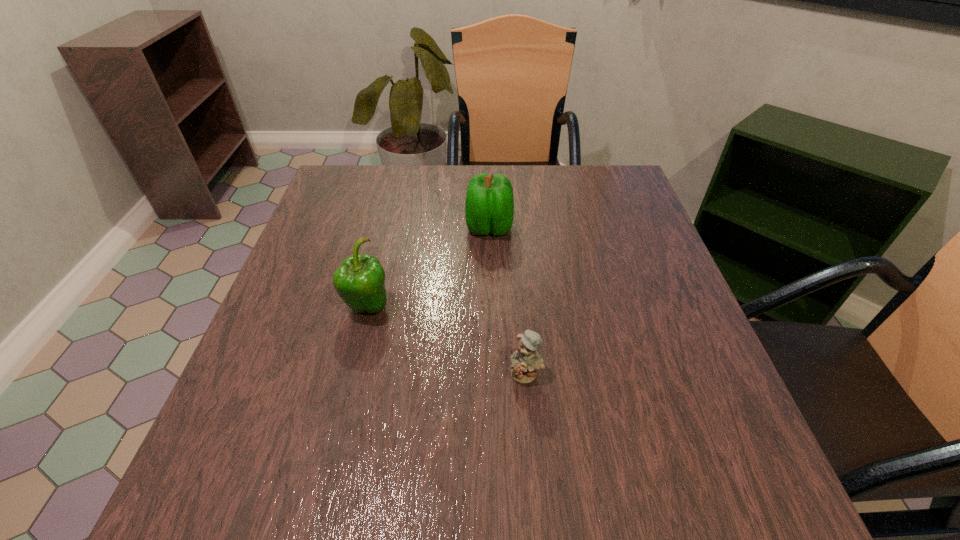
The height and width of the screenshot is (540, 960). Find the location of `the leftmost object`. the leftmost object is located at coordinates (360, 280).

Locate an element on the screen. Image resolution: width=960 pixels, height=540 pixels. the nearer bell pepper is located at coordinates (360, 280).

I want to click on the farthest object, so click(x=489, y=208).

You are a GUI agent. You are given a task and a screenshot of the screen. Output one action in this format:
    pyautogui.click(x=<x>, y=<y>)
    Task: Click on the farther bell pepper
    The height and width of the screenshot is (540, 960).
    Given the screenshot: What is the action you would take?
    pyautogui.click(x=489, y=208)

Locate an element on the screen. The width and height of the screenshot is (960, 540). the shortest object is located at coordinates (525, 361).

The height and width of the screenshot is (540, 960). I want to click on teddy bear, so click(x=525, y=361).

Where is `vacant space situated on the left of the leftmost object`? This screenshot has width=960, height=540. vacant space situated on the left of the leftmost object is located at coordinates (278, 307).

Image resolution: width=960 pixels, height=540 pixels. I want to click on vacant space situated on the front of the right bell pepper, so click(x=491, y=269).

Locate an element on the screen. The image size is (960, 540). free spot located on the front-facing side of the teddy bear is located at coordinates (536, 490).

Identify the location of object that is positioned at the far edge. The width and height of the screenshot is (960, 540). pos(489,208).